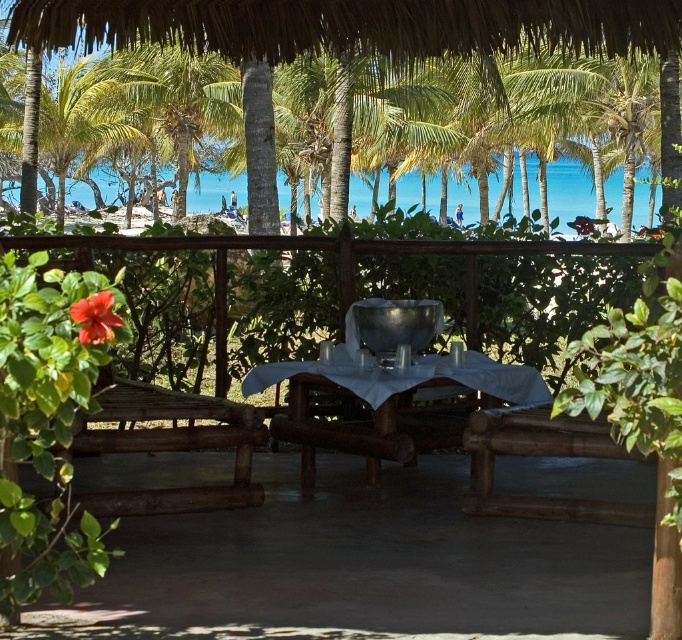
Question: Which of the following is the farthest from the observer?

Choices:
 (A) (479, 417)
 (B) (85, 337)

Answer: (A)

Question: Which point is farther to the camera?

Choices:
 (A) green leafy palm tree at upper left
 (B) red matte flower at upper left

Answer: (A)

Question: Can you confirm if metallic silver bowl at center is positioned to the right of white cloth-covered table at center?

Choices:
 (A) no
 (B) yes

Answer: (A)

Question: Which of the following is the farthest from the observer?

Choices:
 (A) white cloth-covered table at center
 (B) red matte flower at upper left
 (C) green leafy palm tree at upper left

Answer: (C)

Question: Is metallic silver bowl at center above brown wood chair at center?

Choices:
 (A) no
 (B) yes

Answer: (A)

Question: Does metallic silver bowl at center come in front of white cloth-covered table at center?

Choices:
 (A) yes
 (B) no

Answer: (B)